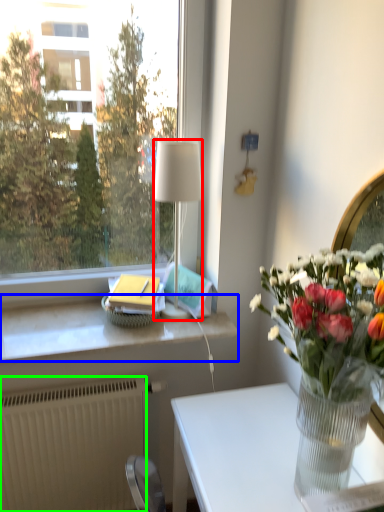
Question: Which is nearer to the lamp (highlighted by a red box)? window sill (highlighted by a blue box) or radiator (highlighted by a green box).

Choices:
 (A) window sill
 (B) radiator

Answer: (A)